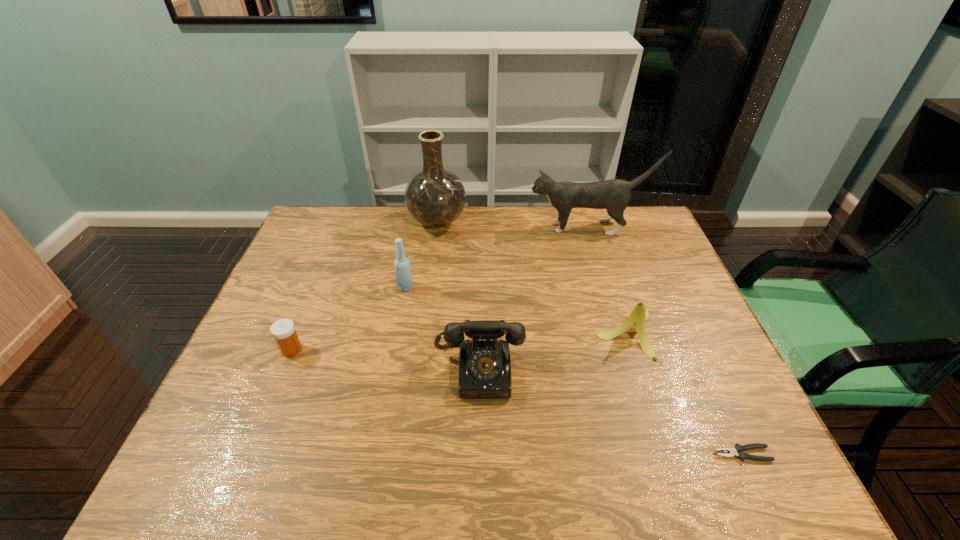
The image size is (960, 540). I want to click on unoccupied position between the sixth tallest object and the fifth nearest object, so click(348, 318).

Where is `vacant area that lies between the pliers and the medicine`? This screenshot has width=960, height=540. vacant area that lies between the pliers and the medicine is located at coordinates (516, 402).

The image size is (960, 540). Find the location of `unoccupied area between the banana and the nearest object`. unoccupied area between the banana and the nearest object is located at coordinates (684, 394).

This screenshot has width=960, height=540. I want to click on free space between the telephone and the cat, so click(x=534, y=299).

Image resolution: width=960 pixels, height=540 pixels. Identify the location of empty space between the medicine and the bottle. (348, 318).

Locate an element on the screen. The height and width of the screenshot is (540, 960). object that ranks as the second closest to the telephone is located at coordinates (403, 273).

The width and height of the screenshot is (960, 540). In order to click on object that is the sixth nearest to the vase in this screenshot , I will do `click(736, 451)`.

Identify the location of vacant region that satisfies the following two spatial constraints: 1. at the face of the banana; 2. on the right side of the cat. This screenshot has height=540, width=960. (621, 333).

Locate an element on the screen. The image size is (960, 540). vacant space that satisfies the following two spatial constraints: 1. on the back side of the bottle; 2. on the left side of the medicine is located at coordinates (317, 287).

The height and width of the screenshot is (540, 960). Identify the location of vacant point that satisfies the following two spatial constraints: 1. at the face of the banana; 2. on the left side of the cat. (621, 333).